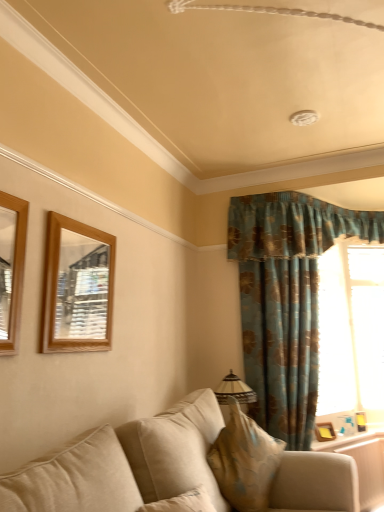
Question: Is wooden mirror at left, which is counted as the fourth picture frame, starting from the bottom, oriented towards wooden mirror at upper left, the second picture frame when ordered from top to bottom?

Choices:
 (A) yes
 (B) no

Answer: (B)

Question: Can you confirm if wooden mirror at left, which is counted as the fourth picture frame, starting from the bottom, is shorter than wooden mirror at upper left, positioned as the second picture frame in left-to-right order?

Choices:
 (A) yes
 (B) no

Answer: (A)

Question: From a real-world perspective, is wooden mirror at left, the 1th picture frame from the front, below wooden mirror at upper left, which appears as the 3th picture frame when viewed from the back?

Choices:
 (A) yes
 (B) no

Answer: (A)

Question: Is wooden mirror at left, which is counted as the fourth picture frame, starting from the bottom, placed right next to wooden mirror at upper left, the second picture frame when ordered from top to bottom?

Choices:
 (A) yes
 (B) no

Answer: (B)

Question: From the image's perspective, would you say wooden mirror at left, which appears as the 1th picture frame when viewed from the top, is positioned over wooden mirror at upper left, the third picture frame in the bottom-to-top sequence?

Choices:
 (A) yes
 (B) no

Answer: (A)

Question: Does wooden mirror at left, arranged as the first picture frame when viewed from the left, appear on the right side of wooden mirror at upper left, the second picture frame when ordered from top to bottom?

Choices:
 (A) yes
 (B) no

Answer: (B)

Question: From the image's perspective, does wooden frame at lower right appear lower than beige fabric pillow at lower center?

Choices:
 (A) no
 (B) yes

Answer: (B)

Question: Does wooden frame at lower right have a lesser width compared to beige fabric pillow at lower center?

Choices:
 (A) yes
 (B) no

Answer: (B)

Question: Is wooden frame at lower right closer to the viewer compared to beige fabric pillow at lower center?

Choices:
 (A) no
 (B) yes

Answer: (A)

Question: From a real-world perspective, is wooden frame at lower right on beige fabric pillow at lower center?

Choices:
 (A) yes
 (B) no

Answer: (B)

Question: Does wooden frame at lower right turn towards beige fabric pillow at lower center?

Choices:
 (A) no
 (B) yes

Answer: (B)

Question: Considering the relative positions of wooden frame at lower right and beige fabric pillow at lower center in the image provided, is wooden frame at lower right to the left of beige fabric pillow at lower center from the viewer's perspective?

Choices:
 (A) yes
 (B) no

Answer: (B)

Question: Can you confirm if wooden mirror at upper left, positioned as the second picture frame in left-to-right order, is taller than wooden picture frame at lower right, positioned as the 2th picture frame in bottom-to-top order?

Choices:
 (A) no
 (B) yes

Answer: (B)